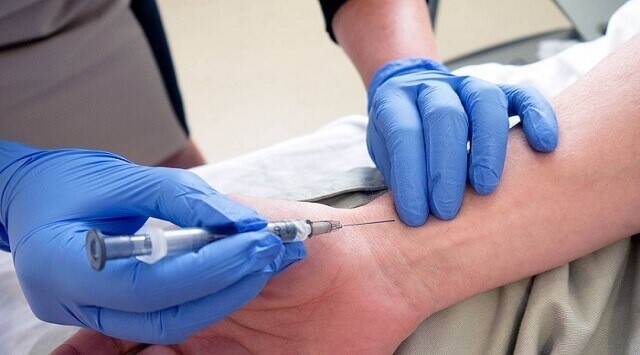
What are the coordinates of `gray fabric` in the screenshot? It's located at (534, 312).